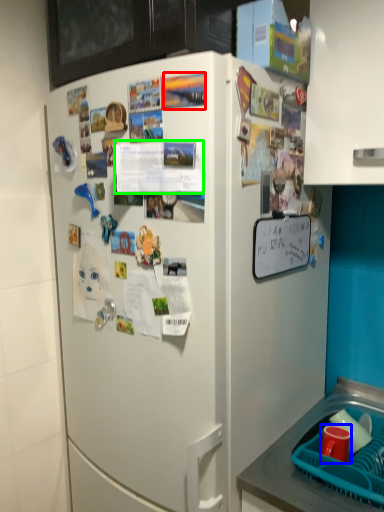
Question: Which object is positioned farthest from poster (highlighted by a red box)? Select from coffee cup (highlighted by a blue box) and poster (highlighted by a green box).

Choices:
 (A) coffee cup
 (B) poster

Answer: (A)